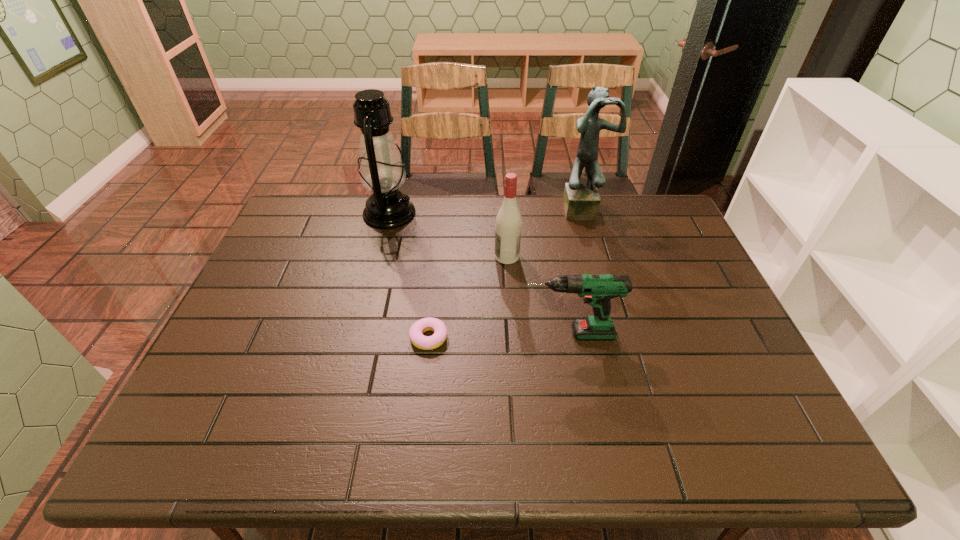
In order to click on free spot that satisfies the following two spatial constraints: 1. on the face of the sculpture; 2. on the handle side of the fourth tallest object in this screenshot , I will do `click(618, 334)`.